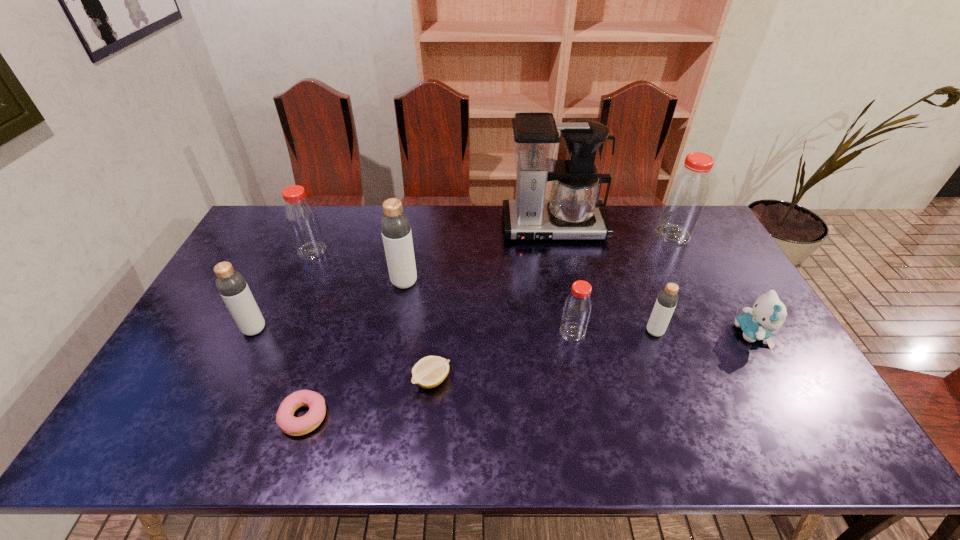
The image size is (960, 540). In the image, there is a desktop. Identify the location of vacant space at the near right corner. click(846, 454).

At what (x,y) coordinates should I click in order to perform the action: click on free space between the gray coffee maker and the smallest gray bottle. Please return your answer as a coordinate pair (x, y). Image resolution: width=960 pixels, height=540 pixels. Looking at the image, I should click on (604, 280).

Identify the location of vacant space in between the gray coffee maker and the third farthest bottle. (479, 255).

At what (x,y) coordinates should I click in order to perform the action: click on free point between the third farthest bottle and the second nearest object. Please return your answer as a coordinate pair (x, y). Image resolution: width=960 pixels, height=540 pixels. Looking at the image, I should click on (419, 331).

Locate an element on the screen. This screenshot has width=960, height=540. vacant space in between the pink doughnut and the leftmost red bottle is located at coordinates (308, 334).

The width and height of the screenshot is (960, 540). I want to click on free point between the rightmost red bottle and the ninth farthest object, so pos(553,307).

Find the location of `vacant space in between the leftmost gray bottle and the doughnut`. vacant space in between the leftmost gray bottle and the doughnut is located at coordinates (279, 373).

This screenshot has width=960, height=540. Identify the location of unoccupied position between the seventh object from right to left and the tallest object. (479, 255).

Identify the location of free spot between the coffee maker and the leftmost red bottle. (433, 239).

Find the location of a particular element. The width and height of the screenshot is (960, 540). object identified as the sixth closest to the biggest red bottle is located at coordinates (428, 372).